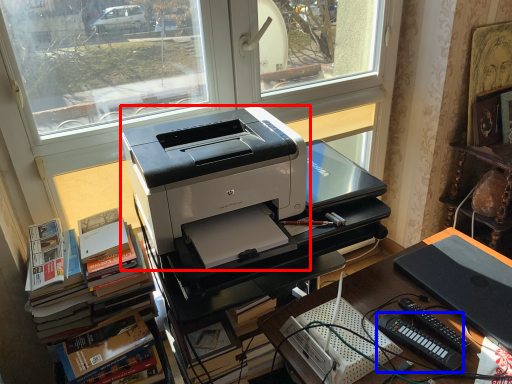
Question: Which object appears closest to the camera in this image, printer (highlighted by a red box) or equipment (highlighted by a blue box)?

Choices:
 (A) printer
 (B) equipment

Answer: (A)